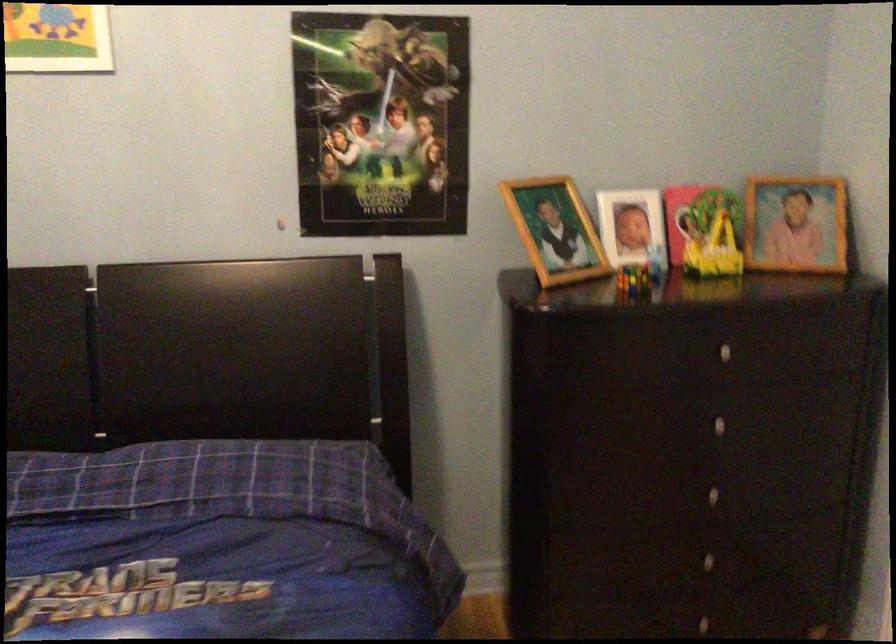
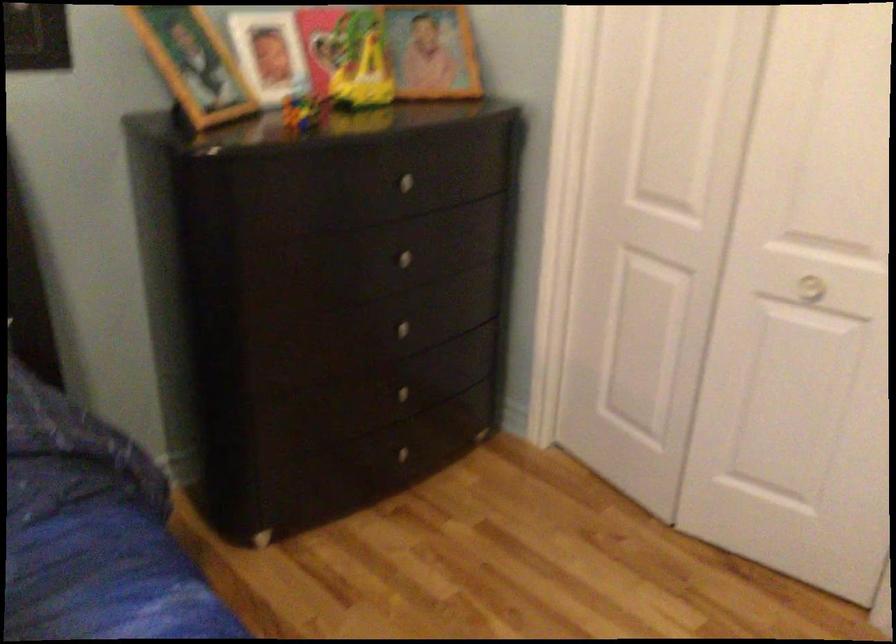
Locate, in the second image, the point that corresponds to point 711,421 in the first image.

(399, 258)